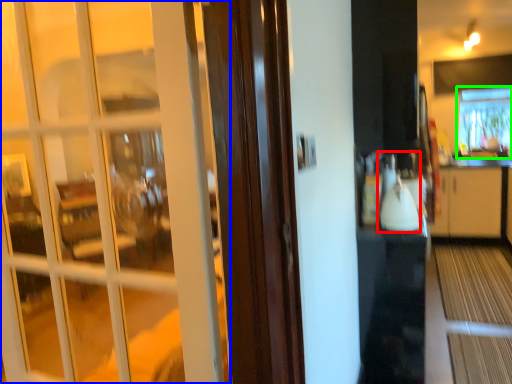
Question: Estimate the real-world distances between objects in this image. Which object is closer to appliance (highlighted by a red box), door (highlighted by a blue box) or window (highlighted by a green box)?

Choices:
 (A) door
 (B) window

Answer: (A)